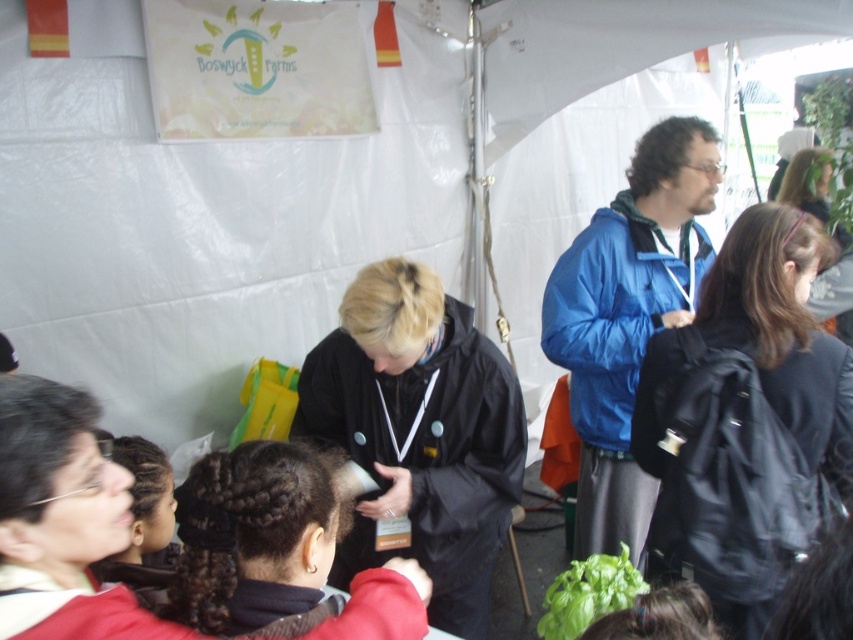
Question: Which point is closer to the camera?

Choices:
 (A) smooth black hair at upper right
 (B) black matte backpack at center-right

Answer: (B)

Question: Can you confirm if black fabric jacket at center is wider than smooth black hair at upper right?

Choices:
 (A) no
 (B) yes

Answer: (B)

Question: Can you confirm if black matte backpack at center-right is smaller than black matte hair at center?

Choices:
 (A) no
 (B) yes

Answer: (A)

Question: Which object appears farthest from the camera in this image?

Choices:
 (A) smooth black hair at upper right
 (B) black matte backpack at center-right
 (C) black matte hair at center

Answer: (A)

Question: Can you confirm if black matte backpack at center-right is wider than black matte jacket at center?

Choices:
 (A) yes
 (B) no

Answer: (B)

Question: Which object appears farthest from the camera in this image?

Choices:
 (A) black fabric jacket at center
 (B) black matte hair at center
 (C) black matte jacket at center
 (D) black matte backpack at center-right

Answer: (D)